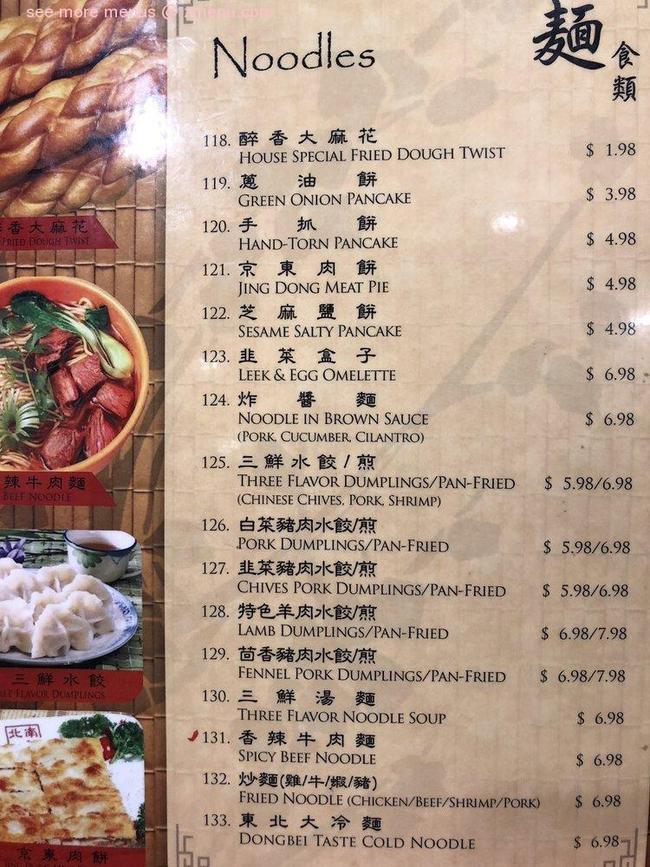
At what (x,y) coordinates should I click in order to perform the action: click on plate. Please return your answer as a coordinate pair (x, y). This screenshot has height=867, width=650. Looking at the image, I should click on (125, 635).